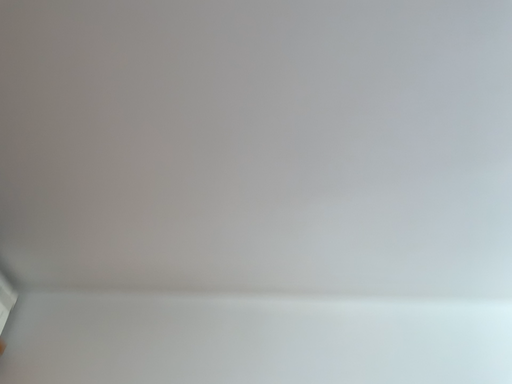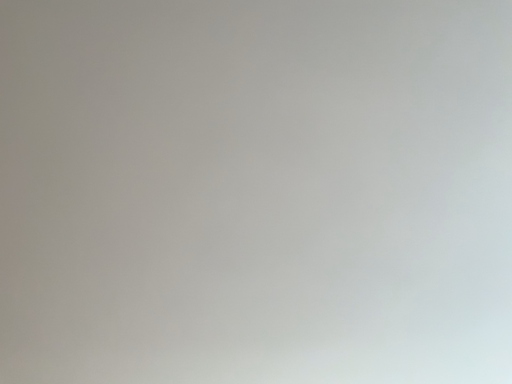
Question: Which way did the camera rotate in the video?

Choices:
 (A) rotated right
 (B) rotated left

Answer: (A)